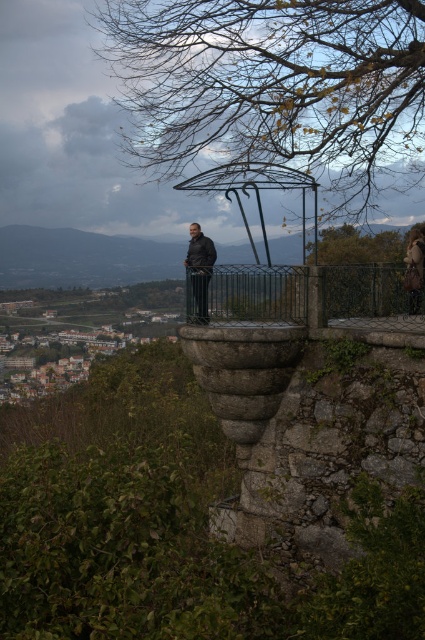
Question: Which point appears closest to the camera in this image?

Choices:
 (A) (360, 275)
 (B) (416, 236)
 (C) (413, 36)
 (D) (189, 276)

Answer: (D)

Question: Which point appears closest to the camera in this image?

Choices:
 (A) (422, 272)
 (B) (206, 275)
 (C) (320, 268)

Answer: (C)

Question: Which point appears farthest from the camera in this image?

Choices:
 (A) (422, 275)
 (B) (231, 282)
 (C) (192, 269)
 (D) (277, 61)

Answer: (D)

Question: Is brown leafy branches at upper center positioned in front of green wrought iron fence at center?

Choices:
 (A) yes
 (B) no

Answer: (B)

Question: Can you confirm if green wrought iron fence at center is wider than dark gray jacket at center?

Choices:
 (A) no
 (B) yes

Answer: (B)

Question: Can you confirm if green wrought iron fence at center is thinner than brown leather jacket at right?

Choices:
 (A) yes
 (B) no

Answer: (B)